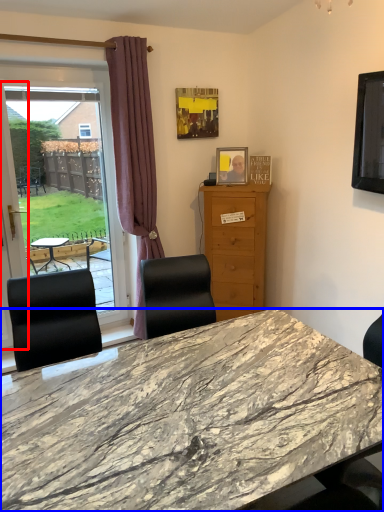
Question: Which of the following is the farthest to the observer, screen door (highlighted by a red box) or desk (highlighted by a blue box)?

Choices:
 (A) screen door
 (B) desk

Answer: (A)